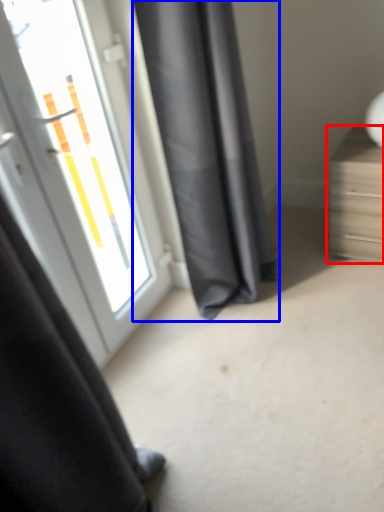
Question: Which object is closer to the camera taking this photo, furniture (highlighted by a red box) or curtain (highlighted by a blue box)?

Choices:
 (A) furniture
 (B) curtain

Answer: (B)